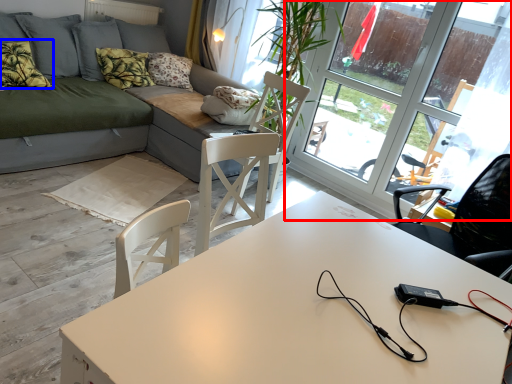
Question: Which object appears farthest to the camera in this image, window (highlighted by a red box) or pillow (highlighted by a blue box)?

Choices:
 (A) window
 (B) pillow

Answer: (B)